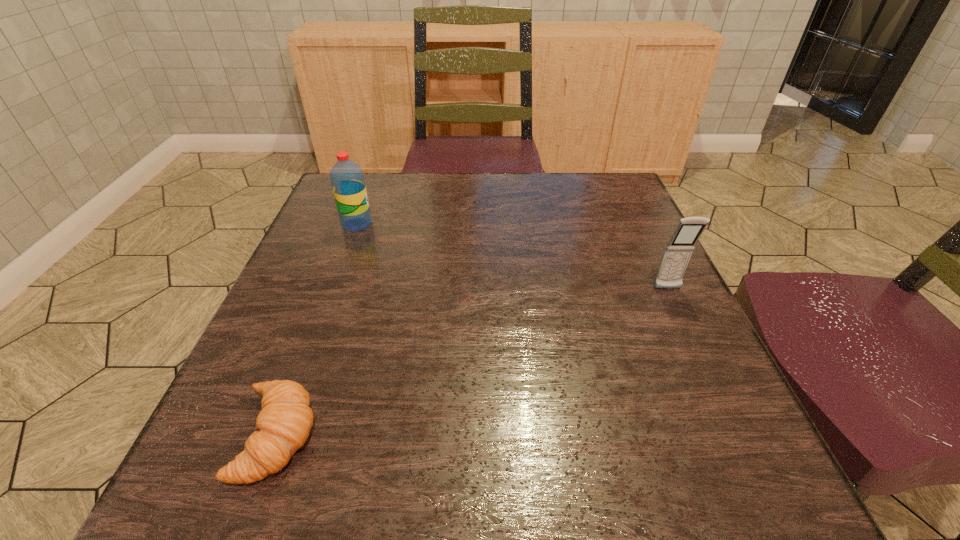
Find the location of a particular element. This screenshot has width=960, height=540. water bottle that is at the left edge is located at coordinates (347, 179).

The image size is (960, 540). I want to click on crescent roll at the left edge, so click(x=284, y=423).

The width and height of the screenshot is (960, 540). I want to click on object present at the right edge, so click(678, 251).

This screenshot has height=540, width=960. What are the coordinates of `object present at the far left corner` in the screenshot? It's located at (347, 179).

This screenshot has width=960, height=540. In order to click on object at the near left corner in this screenshot , I will do `click(284, 423)`.

In the image, there is a desktop. At what (x,y) coordinates should I click in order to perform the action: click on vacant region at the far edge. Please return your answer as a coordinate pair (x, y). The width and height of the screenshot is (960, 540). Looking at the image, I should click on point(476,200).

Find the location of a particular element. This screenshot has width=960, height=540. free space at the near edge is located at coordinates (460, 484).

At what (x,y) coordinates should I click in order to perform the action: click on vacant space at the left edge. Please return your answer as a coordinate pair (x, y). Looking at the image, I should click on (310, 260).

The height and width of the screenshot is (540, 960). In order to click on vacant area at the right edge in this screenshot , I will do `click(612, 272)`.

The image size is (960, 540). Find the location of `vacant position at the far left corner of the desktop`. vacant position at the far left corner of the desktop is located at coordinates (368, 193).